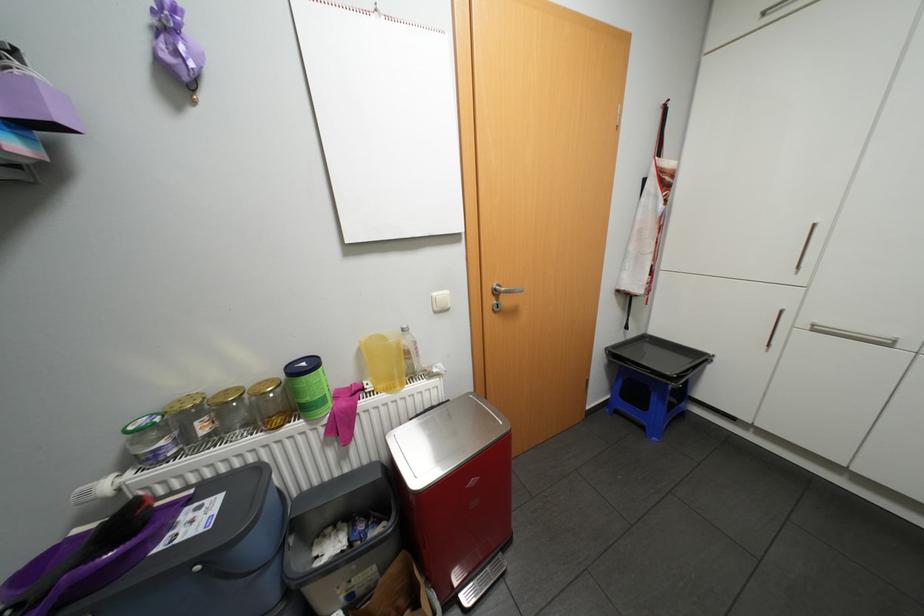
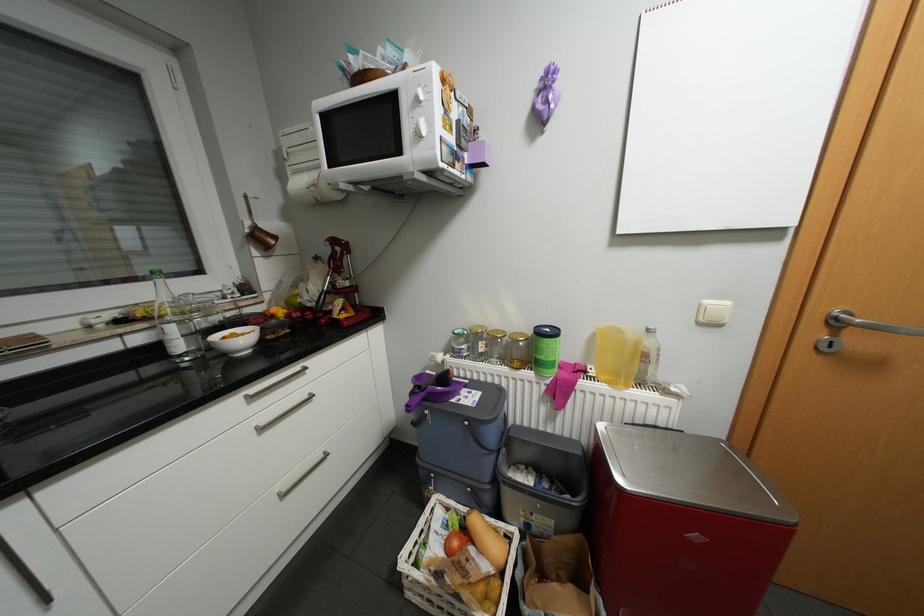
Locate, in the second image, the point that corresponds to [138,474] in the first image.

(456, 355)